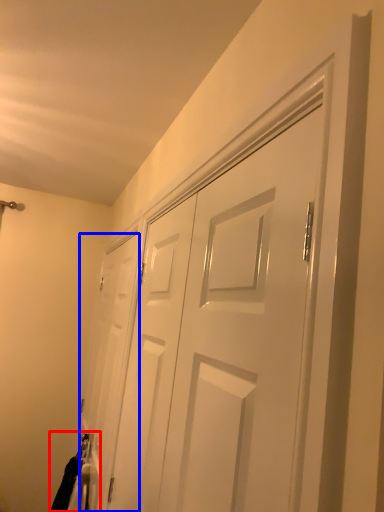
Question: Which of the following is the farthest to the observer, laundry (highlighted by a red box) or door (highlighted by a blue box)?

Choices:
 (A) laundry
 (B) door

Answer: (A)